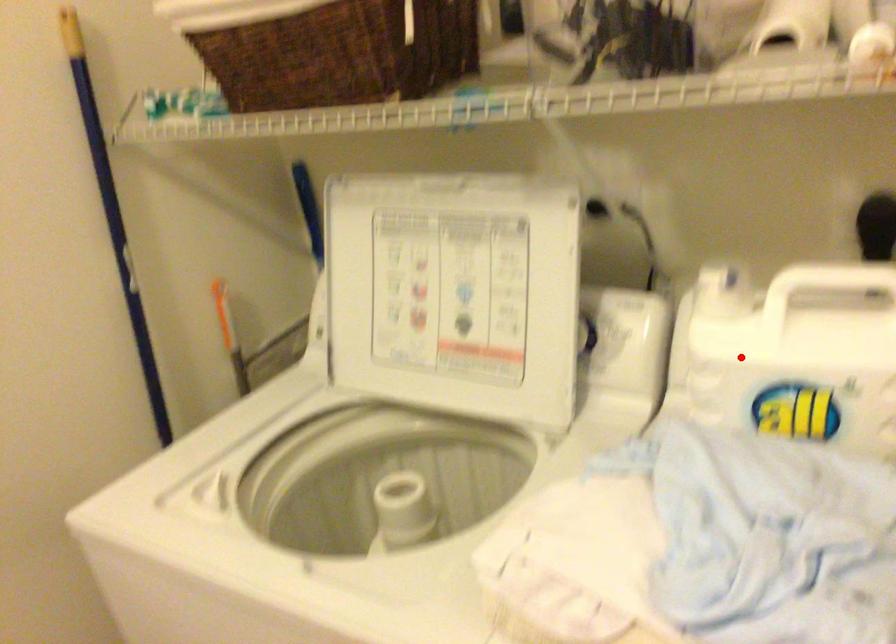
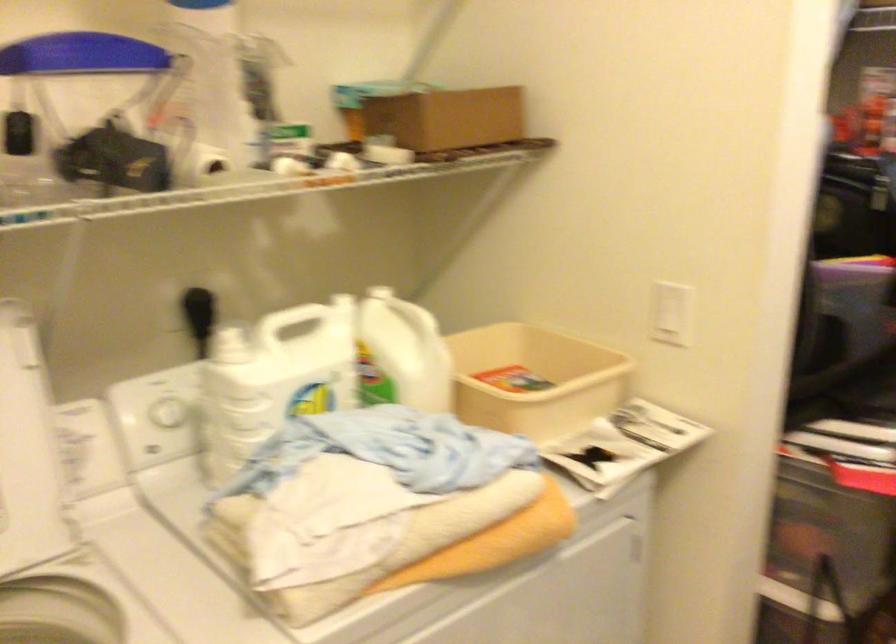
Find the pixel in the second image that matches the highlighted location in the first image.

(273, 379)